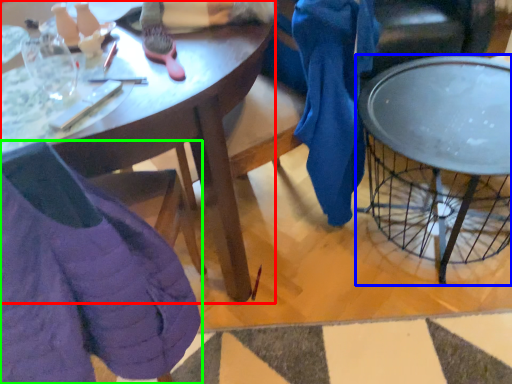
Question: Which object is the closest to the desk (highlighted by a red box)? Choose among these: coffee table (highlighted by a blue box) or chair (highlighted by a green box).

Choices:
 (A) coffee table
 (B) chair

Answer: (B)